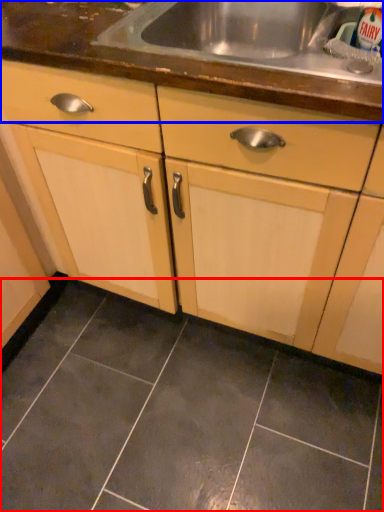
Question: Which object appears farthest to the camera in this image, ceramic tile (highlighted by a red box) or countertop (highlighted by a blue box)?

Choices:
 (A) ceramic tile
 (B) countertop

Answer: (A)